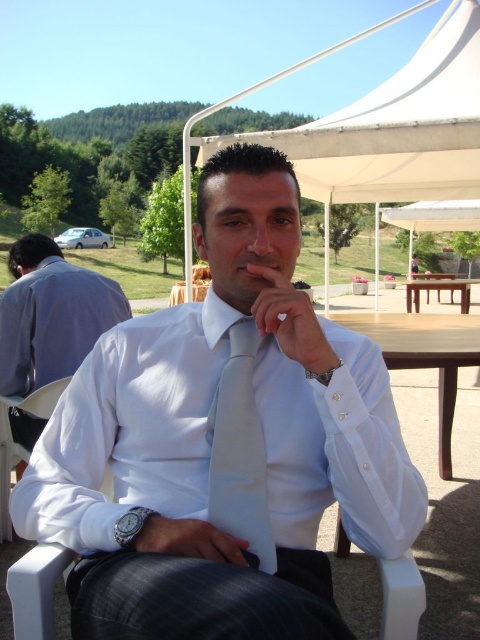
Is light blue silk tie at center positioned at the back of wooden table at center?

That is False.

Is point (216, 461) closer to viewer compared to point (414, 324)?

Yes, it is in front of point (414, 324).

This screenshot has height=640, width=480. Find the location of `light blue silk tie at center`. light blue silk tie at center is located at coordinates (240, 451).

How far apart are white matte shirt at center and brown wooden picnic table at center?

A distance of 10.78 meters exists between white matte shirt at center and brown wooden picnic table at center.

Does white matte shirt at center come in front of brown wooden picnic table at center?

Yes.

What do you see at coordinates (222, 442) in the screenshot?
I see `white matte shirt at center` at bounding box center [222, 442].

The image size is (480, 640). What are the coordinates of `white matte shirt at center` in the screenshot? It's located at pos(222,442).

Which is behind, point (252, 509) or point (467, 289)?

Point (467, 289)

Identify the location of light blue silk tie at center. The height and width of the screenshot is (640, 480). (240, 451).

Between point (235, 525) and point (464, 291), which one is positioned behind?

Positioned behind is point (464, 291).

Locate an element on the screen. The height and width of the screenshot is (640, 480). light blue silk tie at center is located at coordinates (240, 451).